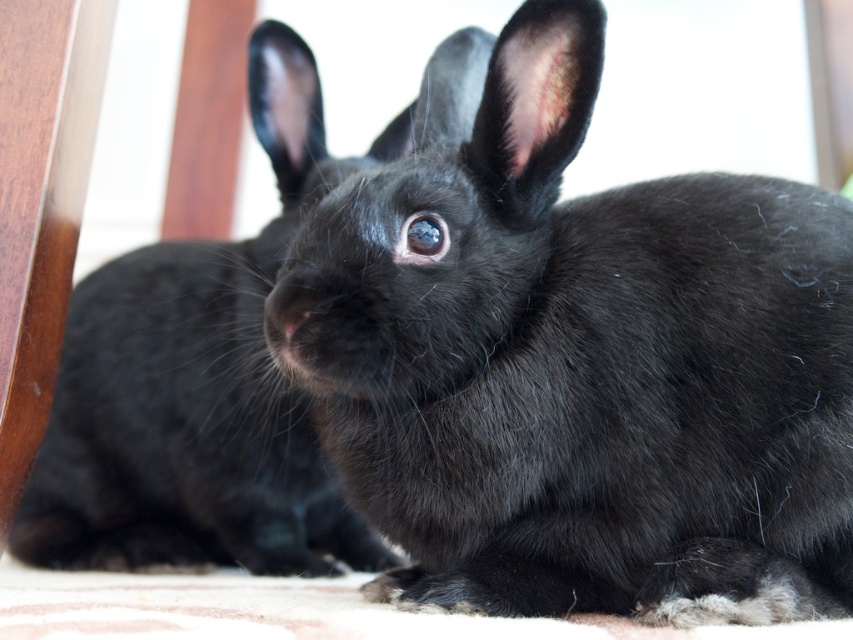
Question: Which point is closer to the camera?

Choices:
 (A) black furry rabbit at center
 (B) black fur rabbit at center

Answer: (B)

Question: Does black fur rabbit at center have a smaller size compared to black furry rabbit at center?

Choices:
 (A) yes
 (B) no

Answer: (A)

Question: Which of the following is the farthest from the observer?

Choices:
 (A) black fur rabbit at center
 (B) black furry rabbit at center

Answer: (B)

Question: Which point is closer to the camera?

Choices:
 (A) black furry rabbit at center
 (B) black fur rabbit at center

Answer: (B)

Question: Does black fur rabbit at center appear on the left side of black furry rabbit at center?

Choices:
 (A) yes
 (B) no

Answer: (B)

Question: Can you confirm if black fur rabbit at center is positioned below black furry rabbit at center?

Choices:
 (A) yes
 (B) no

Answer: (A)